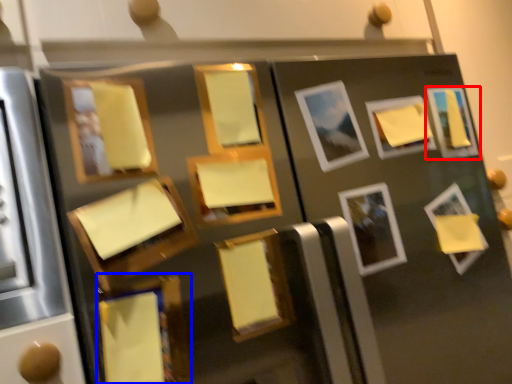
Question: Which of the following is the farthest to the observer, picture frame (highlighted by a red box) or picture frame (highlighted by a blue box)?

Choices:
 (A) picture frame
 (B) picture frame

Answer: (A)